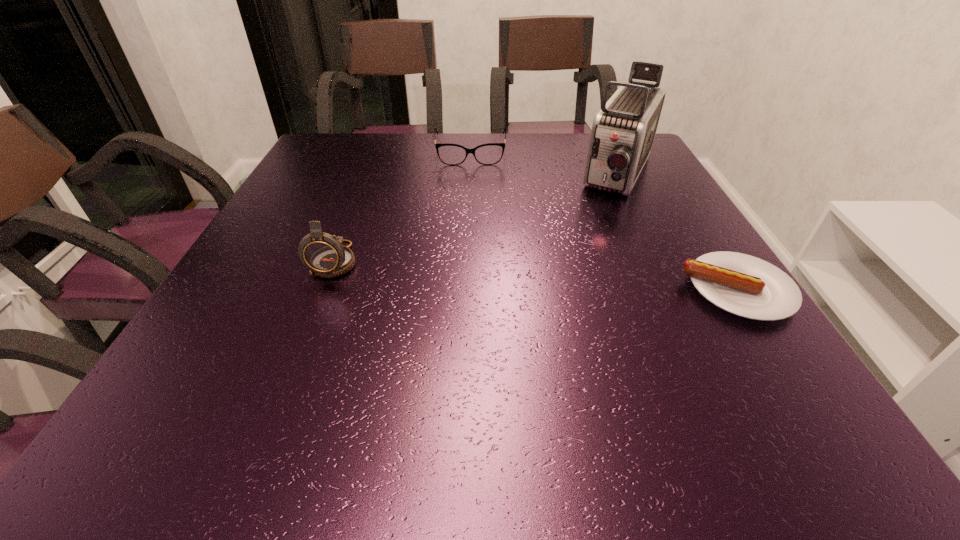
Where is `vacant point that satisfies the following two spatial constraints: 1. on the face of the compass; 2. on the right side of the shortest object`? vacant point that satisfies the following two spatial constraints: 1. on the face of the compass; 2. on the right side of the shortest object is located at coordinates (324, 290).

I want to click on blank area in the image that satisfies the following two spatial constraints: 1. on the front side of the spectacles; 2. on the right side of the sausage, so click(x=466, y=290).